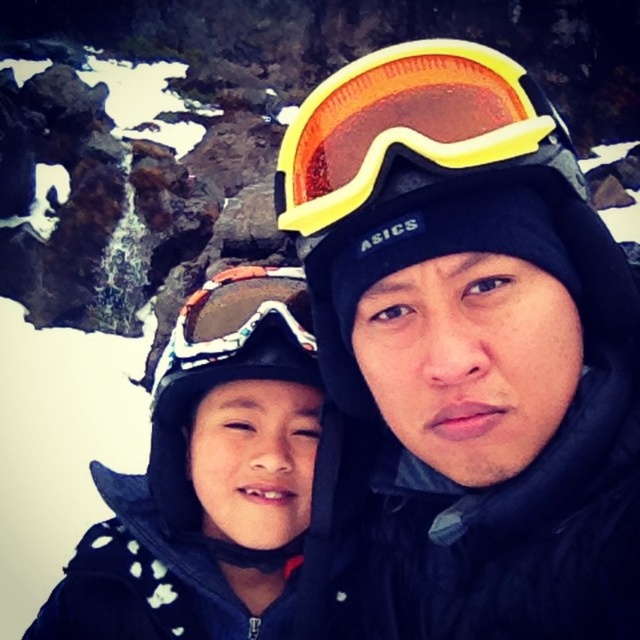
Question: Can you confirm if white polka dot jacket at center is positioned above yellow matte ski goggles at upper center?

Choices:
 (A) yes
 (B) no

Answer: (B)

Question: Which is nearer to the matte black ski goggles at center?

Choices:
 (A) yellow matte ski goggles at upper center
 (B) white polka dot jacket at center

Answer: (A)

Question: Which of the following is the farthest from the observer?

Choices:
 (A) yellow matte ski goggles at upper center
 (B) white polka dot jacket at center
 (C) matte black ski goggles at center

Answer: (B)

Question: Considering the relative positions of white polka dot jacket at center and yellow matte ski goggles at upper center in the image provided, where is white polka dot jacket at center located with respect to yellow matte ski goggles at upper center?

Choices:
 (A) above
 (B) below

Answer: (B)

Question: Can you confirm if matte black ski goggles at center is positioned above white polka dot jacket at center?

Choices:
 (A) yes
 (B) no

Answer: (A)

Question: Which of the following is the closest to the observer?

Choices:
 (A) (164, 563)
 (B) (424, 294)

Answer: (B)